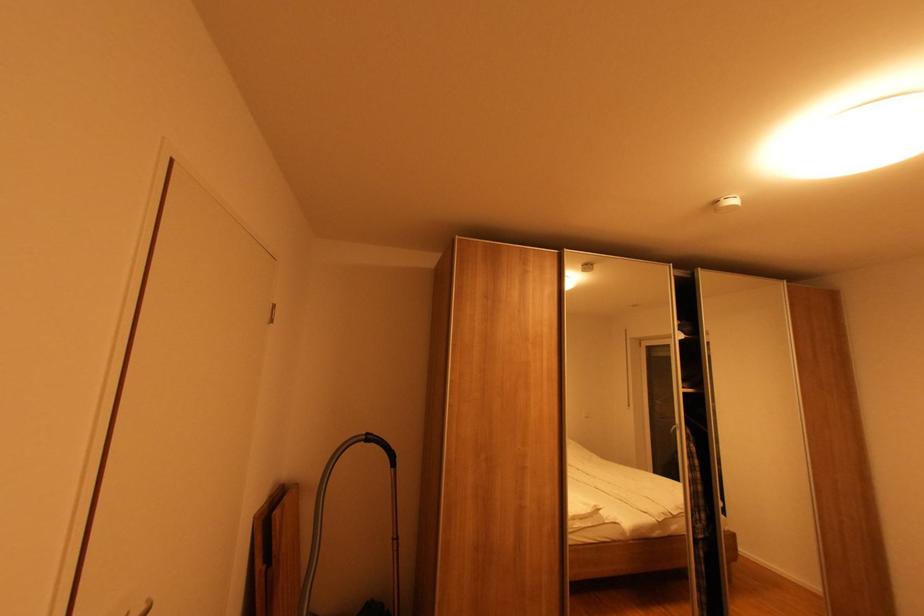
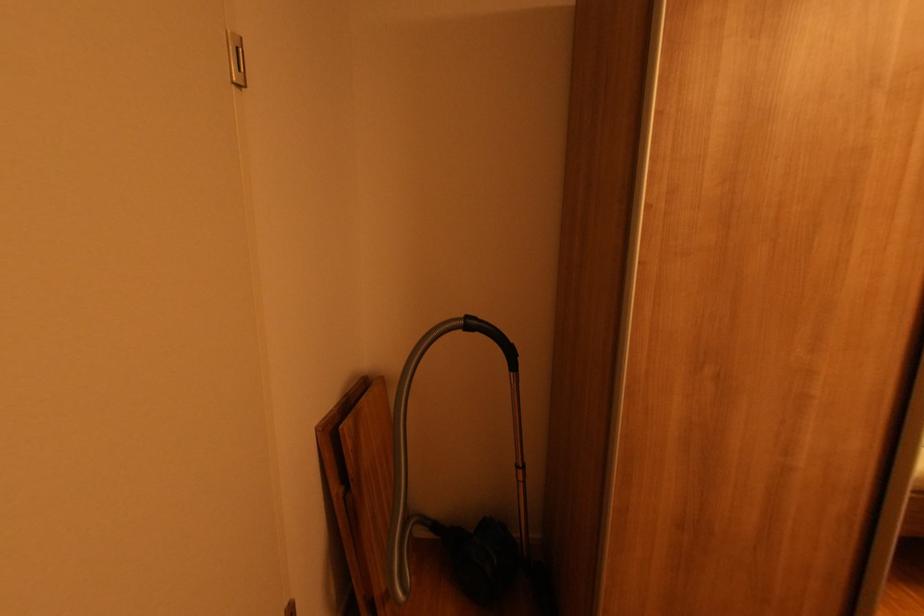
Question: In a continuous first-person perspective shot, in which direction is the camera moving?

Choices:
 (A) Left
 (B) Right
 (C) Forward
 (D) Backward

Answer: (C)